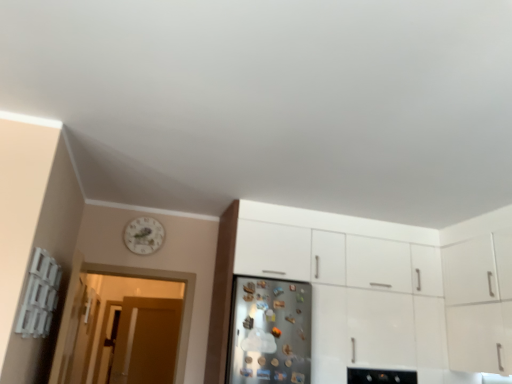
Measure the distance between point (450, 360) and camera.

The depth of point (450, 360) is 3.36 meters.

Locate an element on the screen. Image resolution: width=512 pixels, height=384 pixels. translucent wooden door at left is located at coordinates (121, 305).

This screenshot has width=512, height=384. What do you see at coordinates (269, 331) in the screenshot?
I see `satin silver fridge at center` at bounding box center [269, 331].

Locate an element on the screen. This screenshot has height=384, width=512. white glossy cabinet at center is located at coordinates (376, 289).

Based on the photo, is white glossy clock at upper left positioned far away from brown matte door at left?

No, white glossy clock at upper left is not far from brown matte door at left.

Looking at this image, does white glossy clock at upper left have a lesser height compared to brown matte door at left?

Yes.

Considering the relative sizes of white glossy clock at upper left and brown matte door at left in the image provided, is white glossy clock at upper left bigger than brown matte door at left?

Actually, white glossy clock at upper left might be smaller than brown matte door at left.

Is white glossy clock at upper left at the left side of brown matte door at left?

Incorrect, white glossy clock at upper left is not on the left side of brown matte door at left.

Is white glossy cabinet at center inside the boundaries of translucent wooden door at left, or outside?

white glossy cabinet at center is not inside translucent wooden door at left, it's outside.

Are white glossy cabinet at center and translucent wooden door at left far apart?

Absolutely, white glossy cabinet at center is distant from translucent wooden door at left.

Is white glossy cabinet at center further to the viewer compared to translucent wooden door at left?

No, white glossy cabinet at center is in front of translucent wooden door at left.

Between white glossy cabinet at center and translucent wooden door at left, which one appears on the left side from the viewer's perspective?

translucent wooden door at left.

Considering the relative sizes of brown matte door at left and white glossy cabinet at center in the image provided, is brown matte door at left smaller than white glossy cabinet at center?

Correct, brown matte door at left occupies less space than white glossy cabinet at center.

How different are the orientations of brown matte door at left and white glossy cabinet at center in degrees?

20.6 degrees.

Which object is closer to the camera taking this photo, brown matte door at left or white glossy cabinet at center?

white glossy cabinet at center.

Is there a large distance between brown matte door at left and white glossy cabinet at center?

brown matte door at left is positioned a significant distance from white glossy cabinet at center.

Locate an element on the screen. The image size is (512, 384). clock behind the white glossy cabinet at center is located at coordinates (144, 235).

From a real-world perspective, which object rests below the other?

In real-world perspective, white glossy cabinet at center is lower.

Is white glossy clock at upper left beside white glossy cabinet at center?

No.

Based on their sizes in the image, would you say white glossy clock at upper left is bigger or smaller than white glossy cabinet at center?

Considering their sizes, white glossy clock at upper left takes up less space than white glossy cabinet at center.

From the image's perspective, relative to translucent wooden door at left, is brown matte door at left above or below?

brown matte door at left is below translucent wooden door at left.

Is brown matte door at left far away from translucent wooden door at left?

That's not correct — brown matte door at left is a little close to translucent wooden door at left.

From a real-world perspective, does brown matte door at left sit lower than translucent wooden door at left?

Correct, in the physical world, brown matte door at left is lower than translucent wooden door at left.

Is point (167, 305) in front of point (144, 292)?

No, (167, 305) is behind (144, 292).

Is translucent wooden door at left oriented towards brown matte door at left?

No, translucent wooden door at left is not oriented towards brown matte door at left.

Considering the relative positions of translucent wooden door at left and brown matte door at left in the image provided, is translucent wooden door at left to the left of brown matte door at left from the viewer's perspective?

No, translucent wooden door at left is not to the left of brown matte door at left.

Is translucent wooden door at left not within brown matte door at left?

That's correct, translucent wooden door at left is outside of brown matte door at left.

From the image's perspective, which is below, translucent wooden door at left or brown matte door at left?

brown matte door at left.

How different are the orientations of white glossy cabinet at center and satin silver fridge at center in degrees?

The angle between the facing direction of white glossy cabinet at center and the facing direction of satin silver fridge at center is 0.000166 degrees.

Which is behind, point (347, 325) or point (270, 326)?

The point (347, 325) is farther.

Between white glossy cabinet at center and satin silver fridge at center, which one has smaller size?

satin silver fridge at center.

Looking at this image, between white glossy cabinet at center and satin silver fridge at center, which one is positioned in front?

satin silver fridge at center is closer to the camera.

You are a GUI agent. You are given a task and a screenshot of the screen. Output one action in this format:
    pyautogui.click(x=<x>, y=<y>)
    Task: Click on the clock above the brown matte door at left (from the image's perspective)
    The width and height of the screenshot is (512, 384).
    Given the screenshot: What is the action you would take?
    pyautogui.click(x=144, y=235)

Find the location of `glass door behind the white glossy cabinet at center`. glass door behind the white glossy cabinet at center is located at coordinates (121, 305).

When comparing their distances from brown matte door at left, does white glossy clock at upper left or white glossy cabinet at center seem further?

Among the two, white glossy cabinet at center is located further to brown matte door at left.

Estimate the real-world distances between objects in this image. Which object is closer to white glossy cabinet at center, satin silver fridge at center or brown matte door at left?

satin silver fridge at center.

From the image, which object appears to be farther from white glossy clock at upper left, brown matte door at left or translucent wooden door at left?

The object further to white glossy clock at upper left is brown matte door at left.

Based on their spatial positions, is white glossy clock at upper left or white glossy cabinet at center closer to satin silver fridge at center?

Among the two, white glossy cabinet at center is located nearer to satin silver fridge at center.

When comparing their distances from white glossy clock at upper left, does brown matte door at left or white glossy cabinet at center seem closer?

Based on the image, brown matte door at left appears to be nearer to white glossy clock at upper left.

Looking at this image, based on their spatial positions, is white glossy clock at upper left or white glossy cabinet at center further from translucent wooden door at left?

white glossy cabinet at center is further to translucent wooden door at left.

Estimate the real-world distances between objects in this image. Which object is closer to translucent wooden door at left, white glossy clock at upper left or brown matte door at left?

The object closer to translucent wooden door at left is brown matte door at left.

Which object lies nearer to the anchor point translucent wooden door at left, brown matte door at left or white glossy cabinet at center?

Based on the image, brown matte door at left appears to be nearer to translucent wooden door at left.

Locate an element on the screen. The width and height of the screenshot is (512, 384). clock located between satin silver fridge at center and brown matte door at left in the depth direction is located at coordinates (144, 235).

Image resolution: width=512 pixels, height=384 pixels. I want to click on clock situated between translucent wooden door at left and satin silver fridge at center from left to right, so click(144, 235).

Where is `glass door between white glossy cabinet at center and brown matte door at left in the front-back direction`? glass door between white glossy cabinet at center and brown matte door at left in the front-back direction is located at coordinates (x=121, y=305).

Find the location of `fridge situated between translucent wooden door at left and white glossy cabinet at center from left to right`. fridge situated between translucent wooden door at left and white glossy cabinet at center from left to right is located at coordinates (269, 331).